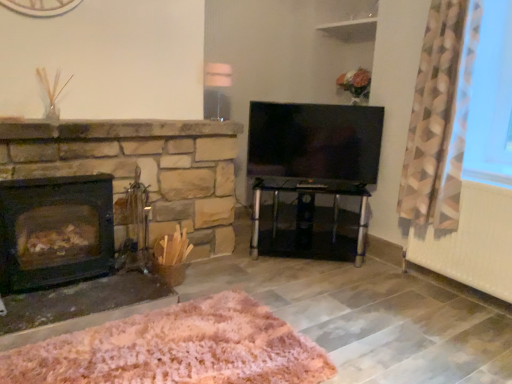
At what (x,y) coordinates should I click in order to perform the action: click on pink fluffy rug at lower center. Please return your answer as a coordinate pair (x, y). This screenshot has width=512, height=384. Looking at the image, I should click on (176, 349).

Locate an element on the screen. The image size is (512, 384). mat lying below the flat-screen tv at center (from the image's perspective) is located at coordinates (176, 349).

From the image's perspective, which is above, flat-screen tv at center or pink fluffy rug at lower center?

flat-screen tv at center is shown above in the image.

Is flat-screen tv at center not inside pink fluffy rug at lower center?

Yes, flat-screen tv at center is located beyond the bounds of pink fluffy rug at lower center.

In terms of width, does flat-screen tv at center look wider or thinner when compared to pink fluffy rug at lower center?

Clearly, flat-screen tv at center has less width compared to pink fluffy rug at lower center.

From the image's perspective, which object appears higher, flat-screen tv at center or transparent glass table at center?

flat-screen tv at center, from the image's perspective.

In the scene shown: Looking at the image, does flat-screen tv at center seem bigger or smaller compared to transparent glass table at center?

Clearly, flat-screen tv at center is smaller in size than transparent glass table at center.

Can we say flat-screen tv at center lies outside transparent glass table at center?

Yes, flat-screen tv at center is not within transparent glass table at center.

Which object is more forward, flat-screen tv at center or transparent glass table at center?

transparent glass table at center.

Considering the relative sizes of geometric-patterned fabric at right and flat-screen tv at center in the image provided, is geometric-patterned fabric at right wider than flat-screen tv at center?

Indeed, geometric-patterned fabric at right has a greater width compared to flat-screen tv at center.

Which of these two, geometric-patterned fabric at right or flat-screen tv at center, stands taller?

With more height is geometric-patterned fabric at right.

Would you say geometric-patterned fabric at right is to the left or to the right of flat-screen tv at center in the picture?

From the image, it's evident that geometric-patterned fabric at right is to the right of flat-screen tv at center.

From a real-world perspective, is geometric-patterned fabric at right positioned above or below flat-screen tv at center?

geometric-patterned fabric at right is situated higher than flat-screen tv at center in the real world.

Between white painted radiator at lower right and flat-screen tv at center, which one has smaller size?

With smaller size is flat-screen tv at center.

Locate an element on the screen. Image resolution: width=512 pixels, height=384 pixels. radiator located on the right of flat-screen tv at center is located at coordinates (472, 242).

What's the angular difference between white painted radiator at lower right and flat-screen tv at center's facing directions?

The angular difference between white painted radiator at lower right and flat-screen tv at center is 51.8 degrees.

Can you confirm if white painted radiator at lower right is thinner than flat-screen tv at center?

No.

Does black matte wood burning stove at left have a lesser height compared to geometric-patterned fabric at right?

Correct, black matte wood burning stove at left is not as tall as geometric-patterned fabric at right.

Locate an element on the screen. The image size is (512, 384). curtain on the right of black matte wood burning stove at left is located at coordinates (437, 121).

In the scene shown: Is black matte wood burning stove at left facing away from geometric-patterned fabric at right?

black matte wood burning stove at left is not turned away from geometric-patterned fabric at right.

Considering the positions of objects black matte wood burning stove at left and geometric-patterned fabric at right in the image provided, who is more to the left, black matte wood burning stove at left or geometric-patterned fabric at right?

black matte wood burning stove at left.

Visually, is transparent glass table at center positioned to the left or to the right of flat-screen tv at center?

transparent glass table at center is to the left of flat-screen tv at center.

Does transparent glass table at center come behind flat-screen tv at center?

That is False.

Who is smaller, transparent glass table at center or flat-screen tv at center?

flat-screen tv at center.

From the image's perspective, is transparent glass table at center below flat-screen tv at center?

Correct, transparent glass table at center appears lower than flat-screen tv at center in the image.

Who is shorter, flat-screen tv at center or geometric-patterned fabric at right?

flat-screen tv at center is shorter.

Which is in front, flat-screen tv at center or geometric-patterned fabric at right?

geometric-patterned fabric at right is closer to the camera.

Does point (339, 123) lie in front of point (405, 159)?

No, (339, 123) is further to viewer.

Is flat-screen tv at center located outside geometric-patterned fabric at right?

Yes.

This screenshot has height=384, width=512. Find the location of `mat on the left of flat-screen tv at center`. mat on the left of flat-screen tv at center is located at coordinates tap(176, 349).

In the image, there is a flat-screen tv at center. Identify the location of table below it (from the image's perspective). The width and height of the screenshot is (512, 384). (314, 193).

Based on their spatial positions, is flat-screen tv at center or geometric-patterned fabric at right closer to pink fluffy rug at lower center?

The object closer to pink fluffy rug at lower center is flat-screen tv at center.

From the image, which object appears to be farther from flat-screen tv at center, white painted radiator at lower right or geometric-patterned fabric at right?

white painted radiator at lower right.

From the image, which object appears to be nearer to white painted radiator at lower right, geometric-patterned fabric at right or transparent glass table at center?

geometric-patterned fabric at right lies closer to white painted radiator at lower right than the other object.

From the image, which object appears to be nearer to geometric-patterned fabric at right, white painted radiator at lower right or pink fluffy rug at lower center?

white painted radiator at lower right.

When comparing their distances from transparent glass table at center, does white painted radiator at lower right or geometric-patterned fabric at right seem closer?

geometric-patterned fabric at right lies closer to transparent glass table at center than the other object.

Considering their positions, is white painted radiator at lower right positioned closer to transparent glass table at center than flat-screen tv at center?

flat-screen tv at center is closer to transparent glass table at center.

Which object lies nearer to the anchor point flat-screen tv at center, black matte wood burning stove at left or white painted radiator at lower right?

white painted radiator at lower right lies closer to flat-screen tv at center than the other object.

Based on their spatial positions, is flat-screen tv at center or transparent glass table at center closer to white painted radiator at lower right?

transparent glass table at center is positioned closer to the anchor white painted radiator at lower right.

Where is `radiator between geometric-patterned fabric at right and flat-screen tv at center in the front-back direction`? radiator between geometric-patterned fabric at right and flat-screen tv at center in the front-back direction is located at coordinates (472, 242).

Identify the location of curtain between black matte wood burning stove at left and white painted radiator at lower right in the horizontal direction. The height and width of the screenshot is (384, 512). (437, 121).

The height and width of the screenshot is (384, 512). What are the coordinates of `radiator between pink fluffy rug at lower center and transparent glass table at center along the z-axis` in the screenshot? It's located at (472, 242).

Locate an element on the screen. The height and width of the screenshot is (384, 512). curtain between pink fluffy rug at lower center and flat-screen tv at center in the front-back direction is located at coordinates (437, 121).